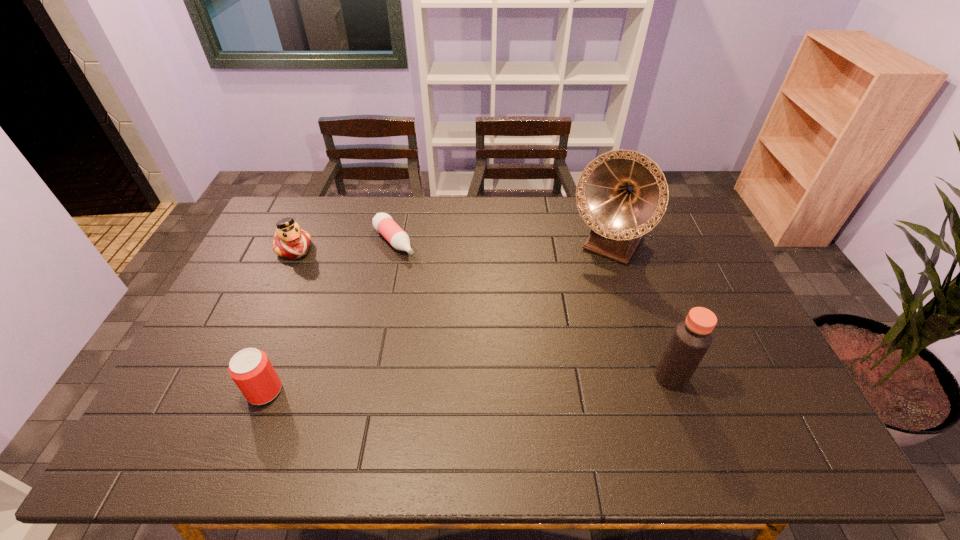
At what (x,y) coordinates should I click in order to perform the action: click on free area in between the phonograph record and the third object from left to right. Please return your answer as a coordinate pair (x, y). The height and width of the screenshot is (540, 960). Looking at the image, I should click on (501, 244).

You are a GUI agent. You are given a task and a screenshot of the screen. Output one action in this format:
    pyautogui.click(x=<x>, y=<y>)
    Task: Click on the unoccupied area between the shortest object and the duck
    The width and height of the screenshot is (960, 540).
    Given the screenshot: What is the action you would take?
    pyautogui.click(x=345, y=246)

Where is `vacant area that lies between the beer can and the duck`? vacant area that lies between the beer can and the duck is located at coordinates (279, 320).

Find the location of a particular element. The height and width of the screenshot is (540, 960). empty location between the vinegar and the phonograph record is located at coordinates (639, 312).

Identify the location of free space between the tallest object and the beer can. (436, 318).

Identify the location of vacant area that lies between the phonograph record and the duck. The height and width of the screenshot is (540, 960). (451, 247).

Where is `vacant region between the bottle and the duck`? Image resolution: width=960 pixels, height=540 pixels. vacant region between the bottle and the duck is located at coordinates (345, 246).

The width and height of the screenshot is (960, 540). What are the coordinates of `empty space between the vinegar and the bottle` in the screenshot? It's located at (533, 310).

Locate an element on the screen. free area in between the duck and the shortest object is located at coordinates (345, 246).

The image size is (960, 540). In order to click on the second closest object relative to the tallest object in this screenshot , I will do `click(383, 223)`.